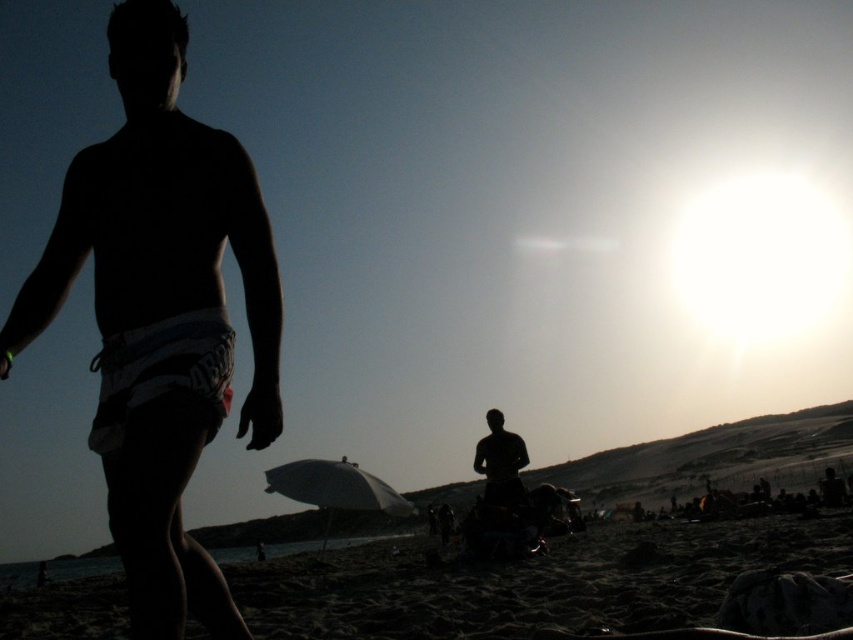
You are standing on the beach and see the silhouette shorts at left. Based on the position of the sun, which direction is the person facing?

The silhouette shorts at left is located at point (161, 314), so the person is facing away from the sun towards the beach.

You are a photographer trying to capture the silhouette of the silhouette shorts at left and the silhouette figure at center in the same frame. Given their sizes, which one will appear bigger in your photo?

The silhouette shorts at left will appear bigger in the photo because they have a larger size compared to the silhouette figure at center.